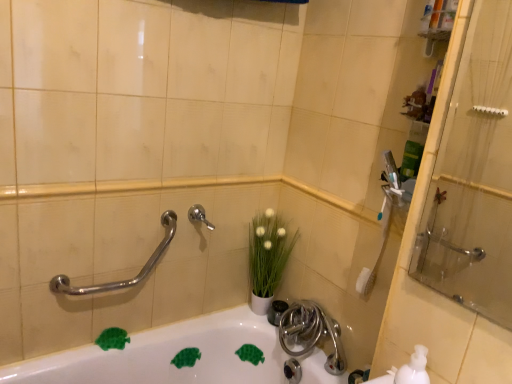
Question: Is polished chrome grab bar at upper left not near satin nickel faucet at center?

Choices:
 (A) no
 (B) yes

Answer: (A)

Question: Considering the relative sizes of polished chrome grab bar at upper left and satin nickel faucet at center in the image provided, is polished chrome grab bar at upper left smaller than satin nickel faucet at center?

Choices:
 (A) no
 (B) yes

Answer: (A)

Question: Considering the relative sizes of polished chrome grab bar at upper left and satin nickel faucet at center in the image provided, is polished chrome grab bar at upper left wider than satin nickel faucet at center?

Choices:
 (A) yes
 (B) no

Answer: (A)

Question: Can satin nickel faucet at center be found inside polished chrome grab bar at upper left?

Choices:
 (A) yes
 (B) no

Answer: (B)

Question: From a real-world perspective, is polished chrome grab bar at upper left positioned over satin nickel faucet at center based on gravity?

Choices:
 (A) no
 (B) yes

Answer: (A)

Question: From the image's perspective, is white glossy bathtub at lower center located above or below polished chrome grab bar at upper left?

Choices:
 (A) above
 (B) below

Answer: (B)

Question: Considering the positions of white glossy bathtub at lower center and polished chrome grab bar at upper left in the image, is white glossy bathtub at lower center bigger or smaller than polished chrome grab bar at upper left?

Choices:
 (A) big
 (B) small

Answer: (A)

Question: Is point (169, 380) positioned closer to the camera than point (161, 248)?

Choices:
 (A) farther
 (B) closer

Answer: (A)

Question: Do you think white glossy bathtub at lower center is within polished chrome grab bar at upper left, or outside of it?

Choices:
 (A) inside
 (B) outside

Answer: (B)

Question: Is white matte vase at center taller or shorter than satin nickel faucet at lower center?

Choices:
 (A) tall
 (B) short

Answer: (A)

Question: Is point (263, 238) positioned closer to the camera than point (325, 332)?

Choices:
 (A) closer
 (B) farther

Answer: (B)

Question: Is white matte vase at center in front of or behind satin nickel faucet at lower center in the image?

Choices:
 (A) behind
 (B) front

Answer: (A)

Question: From a real-world perspective, is white matte vase at center above or below satin nickel faucet at lower center?

Choices:
 (A) above
 (B) below

Answer: (A)

Question: Looking at their shapes, would you say polished chrome grab bar at upper left is wider or thinner than satin nickel faucet at center?

Choices:
 (A) thin
 (B) wide

Answer: (B)

Question: Which is correct: polished chrome grab bar at upper left is inside satin nickel faucet at center, or outside of it?

Choices:
 (A) outside
 (B) inside

Answer: (A)